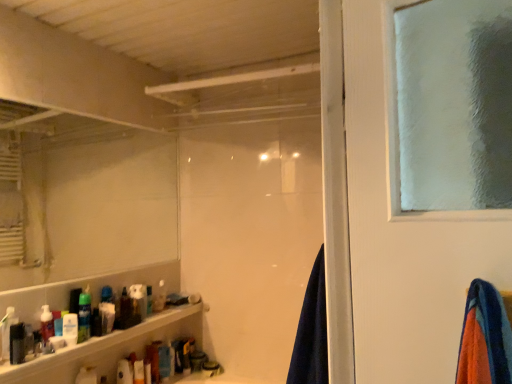
Question: Should I look upward or downward to see matte black bottle at lower left, the first toiletry in the front-to-back sequence?

Choices:
 (A) up
 (B) down

Answer: (B)

Question: From the image's perspective, is white matte toothpaste tube at lower left, the third toiletry in the back-to-front sequence, above white matte mirror at upper left?

Choices:
 (A) yes
 (B) no

Answer: (B)

Question: Is white matte toothpaste tube at lower left, the third toiletry in the back-to-front sequence, facing away from white matte mirror at upper left?

Choices:
 (A) yes
 (B) no

Answer: (B)

Question: Is white matte toothpaste tube at lower left, the third toiletry in the back-to-front sequence, outside white matte mirror at upper left?

Choices:
 (A) no
 (B) yes

Answer: (B)

Question: From a real-world perspective, is white matte toothpaste tube at lower left, placed as the sixth toiletry when sorted from front to back, located beneath white matte mirror at upper left?

Choices:
 (A) yes
 (B) no

Answer: (A)

Question: Considering the relative sizes of white matte toothpaste tube at lower left, the third toiletry in the back-to-front sequence, and white matte mirror at upper left in the image provided, is white matte toothpaste tube at lower left, the third toiletry in the back-to-front sequence, thinner than white matte mirror at upper left?

Choices:
 (A) yes
 (B) no

Answer: (B)

Question: From a real-world perspective, is white matte toothpaste tube at lower left, placed as the sixth toiletry when sorted from front to back, on top of white matte mirror at upper left?

Choices:
 (A) no
 (B) yes

Answer: (A)

Question: Is matte black bottle at lower left, marked as the eighth toiletry in a back-to-front arrangement, smaller than translucent plastic bottle at lower left, the eighth toiletry from the front?

Choices:
 (A) no
 (B) yes

Answer: (A)

Question: Does matte black bottle at lower left, marked as the eighth toiletry in a back-to-front arrangement, touch translucent plastic bottle at lower left, the 1th toiletry positioned from the back?

Choices:
 (A) no
 (B) yes

Answer: (A)

Question: Is matte black bottle at lower left, the first toiletry in the front-to-back sequence, positioned far away from translucent plastic bottle at lower left, the eighth toiletry from the front?

Choices:
 (A) yes
 (B) no

Answer: (B)

Question: Can you confirm if matte black bottle at lower left, marked as the eighth toiletry in a back-to-front arrangement, is wider than translucent plastic bottle at lower left, the eighth toiletry from the front?

Choices:
 (A) no
 (B) yes

Answer: (B)

Question: Is matte black bottle at lower left, marked as the eighth toiletry in a back-to-front arrangement, to the right of translucent plastic bottle at lower left, the eighth toiletry from the front, from the viewer's perspective?

Choices:
 (A) no
 (B) yes

Answer: (A)

Question: From a real-world perspective, does matte black bottle at lower left, the first toiletry in the front-to-back sequence, stand above translucent plastic bottle at lower left, the eighth toiletry from the front?

Choices:
 (A) no
 (B) yes

Answer: (B)

Question: Is translucent plastic bottles at lower left further to camera compared to translucent plastic spray can at lower left, which is counted as the 4th toiletry, starting from the back?

Choices:
 (A) no
 (B) yes

Answer: (A)